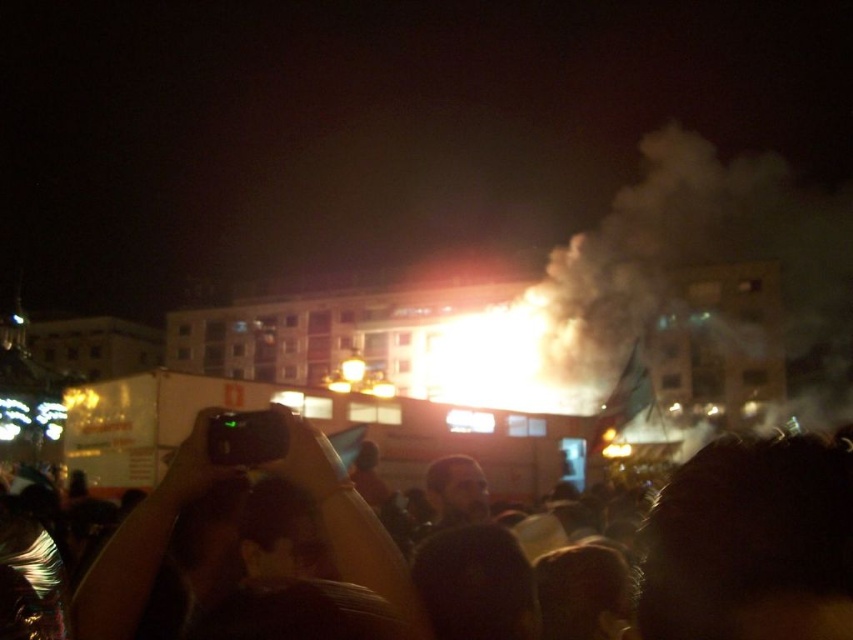
Question: Considering the relative positions of black matte crowd at center and smokesmoky/black at upper center in the image provided, where is black matte crowd at center located with respect to smokesmoky/black at upper center?

Choices:
 (A) left
 (B) right

Answer: (A)

Question: Is smokesmoky/black at upper center wider than matte black camera at center?

Choices:
 (A) yes
 (B) no

Answer: (A)

Question: Can you confirm if black matte crowd at center is positioned to the left of smokesmoky/black at upper center?

Choices:
 (A) no
 (B) yes

Answer: (B)

Question: Considering the real-world distances, which object is closest to the matte black camera at center?

Choices:
 (A) black matte crowd at center
 (B) smokesmoky/black at upper center

Answer: (A)

Question: Which is nearer to the black matte crowd at center?

Choices:
 (A) smokesmoky/black at upper center
 (B) matte black camera at center

Answer: (B)

Question: Which of the following is the farthest from the observer?

Choices:
 (A) matte black camera at center
 (B) smokesmoky/black at upper center

Answer: (B)